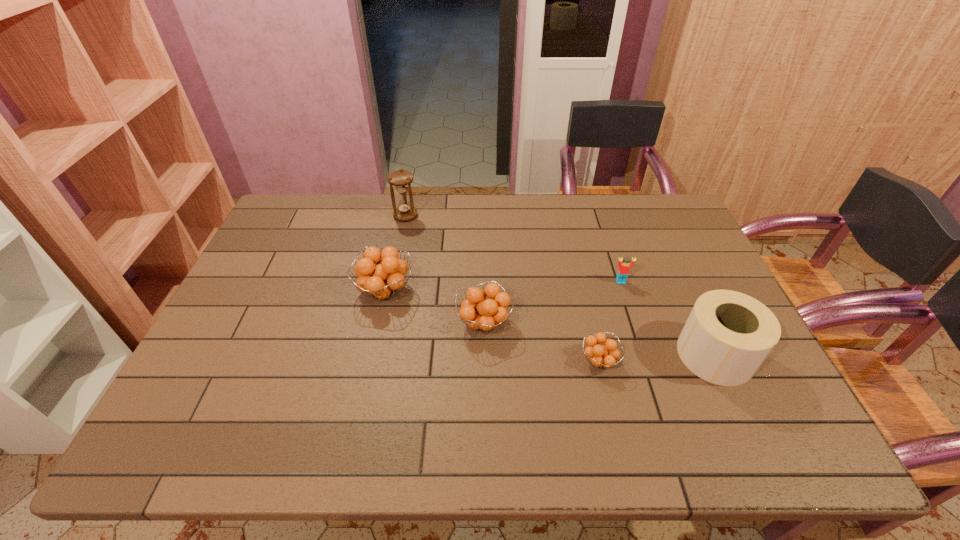
At what (x,y) coordinates should I click in order to perform the action: click on blank region between the toilet tissue and the hourglass. Please return your answer as a coordinate pair (x, y). The image size is (960, 540). Looking at the image, I should click on click(561, 285).

At what (x,y) coordinates should I click in order to perform the action: click on free space that is in between the third object from left to right and the fifth tallest object. Please return your answer as a coordinate pair (x, y). Looking at the image, I should click on (553, 302).

Where is `object identified as the fifth closest to the farthest object`? This screenshot has width=960, height=540. object identified as the fifth closest to the farthest object is located at coordinates coord(728,335).

In order to click on the closest object to the toilet tissue in this screenshot , I will do `click(604, 356)`.

This screenshot has height=540, width=960. Find the location of `orange fruit that is the closest to the farthest object`. orange fruit that is the closest to the farthest object is located at coordinates (383, 281).

Choose which orange fruit is the second nearest neighbor to the leftmost orange fruit. Please provide its 2D coordinates. Your answer should be formatted as a tuple, i.e. [(x, y)], where the tuple contains the x and y coordinates of a point satisfying the conditions above.

[(604, 356)]

Image resolution: width=960 pixels, height=540 pixels. What are the coordinates of `vacant space that satisfies the following two spatial constraints: 1. on the front side of the shortest object; 2. on the left side of the fourth object from right to left` in the screenshot? It's located at (485, 361).